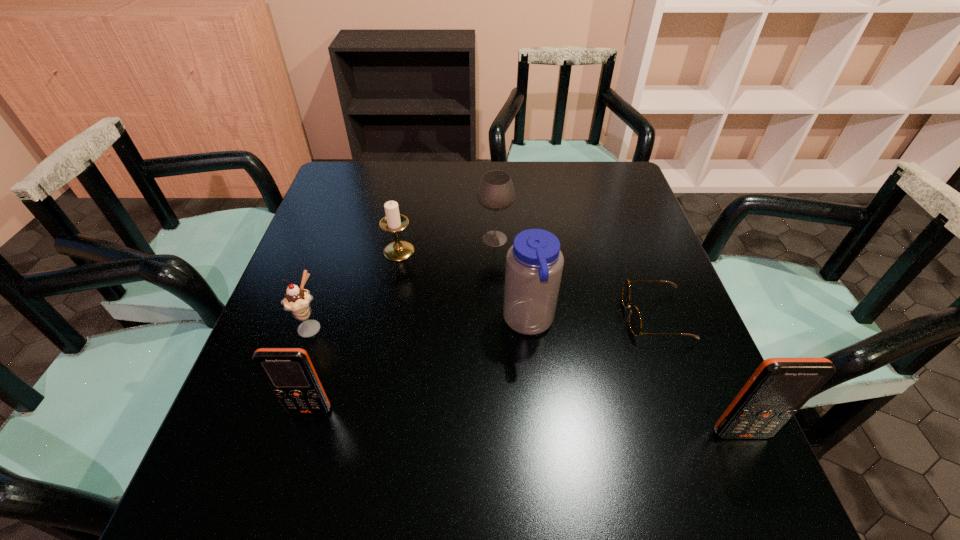
At what (x,y) coordinates should I click in order to perform the action: click on vacant space at the near right corner of the desktop. Please return your answer as a coordinate pair (x, y). The height and width of the screenshot is (540, 960). Looking at the image, I should click on (681, 422).

At what (x,y) coordinates should I click in order to perform the action: click on vacant region between the candle holder and the wineglass. Please return your answer as a coordinate pair (x, y). The height and width of the screenshot is (540, 960). Looking at the image, I should click on (446, 245).

Identify the location of vacant area that lies between the icecream and the nearest object. The width and height of the screenshot is (960, 540). (525, 380).

Locate an element on the screen. vacant point located between the icecream and the nearer cellular telephone is located at coordinates (525, 380).

This screenshot has width=960, height=540. Identify the location of unoccupied area between the sixth farthest object and the third object from left to right. (354, 330).

Identify the location of empty space between the shortest object and the taller cellular telephone. Image resolution: width=960 pixels, height=540 pixels. (698, 375).

Find the location of a particular element. free space between the wineglass and the nearest object is located at coordinates (618, 336).

Where is `free space between the farther cellular telephone and the sunglasses`? The width and height of the screenshot is (960, 540). free space between the farther cellular telephone and the sunglasses is located at coordinates (482, 363).

In order to click on vacant area between the fifth object from right to left and the water bottle in this screenshot , I will do `click(464, 287)`.

Choose which object is the second nearest neighbor to the farther cellular telephone. Please provide its 2D coordinates. Your answer should be formatted as a tuple, i.e. [(x, y)], where the tuple contains the x and y coordinates of a point satisfying the conditions above.

[(534, 263)]